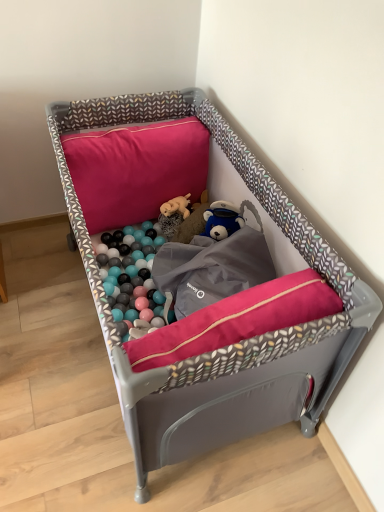
Question: In terms of height, does fluffy beige stuffed animal at center look taller or shorter compared to pink fabric pillow at upper center?

Choices:
 (A) tall
 (B) short

Answer: (B)

Question: Considering the positions of point (168, 212) and point (99, 148), is point (168, 212) closer or farther from the camera than point (99, 148)?

Choices:
 (A) farther
 (B) closer

Answer: (A)

Question: Which of these objects is positioned closest to the matte gray playpen at center?

Choices:
 (A) fluffy beige stuffed animal at center
 (B) pink fabric pillow at upper center

Answer: (B)

Question: Estimate the real-world distances between objects in this image. Which object is farther from the matte gray playpen at center?

Choices:
 (A) pink fabric pillow at upper center
 (B) fluffy beige stuffed animal at center

Answer: (B)